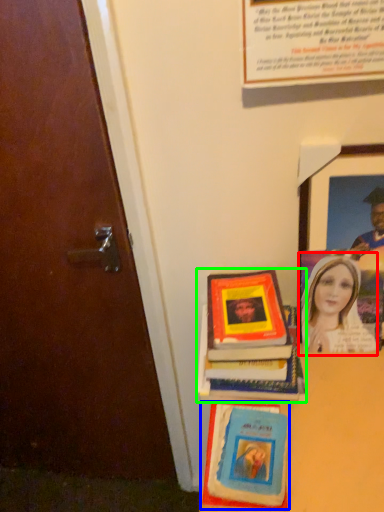
Question: Estimate the real-world distances between objects in this image. Which object is farther from woman (highlighted by a red box), book cover (highlighted by a blue box) or book (highlighted by a green box)?

Choices:
 (A) book cover
 (B) book

Answer: (A)